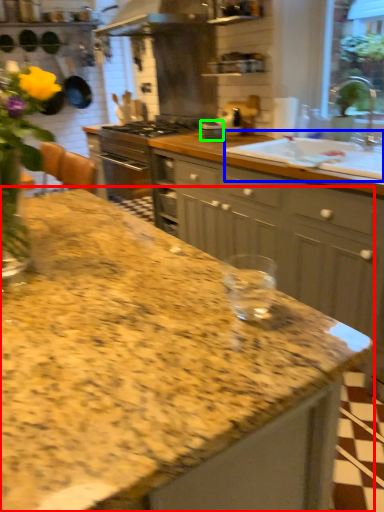
Question: Estimate the real-world distances between objects in this image. Which object is closer to countertop (highlighted by a red box), sink (highlighted by a blue box) or appliance (highlighted by a green box)?

Choices:
 (A) sink
 (B) appliance

Answer: (A)